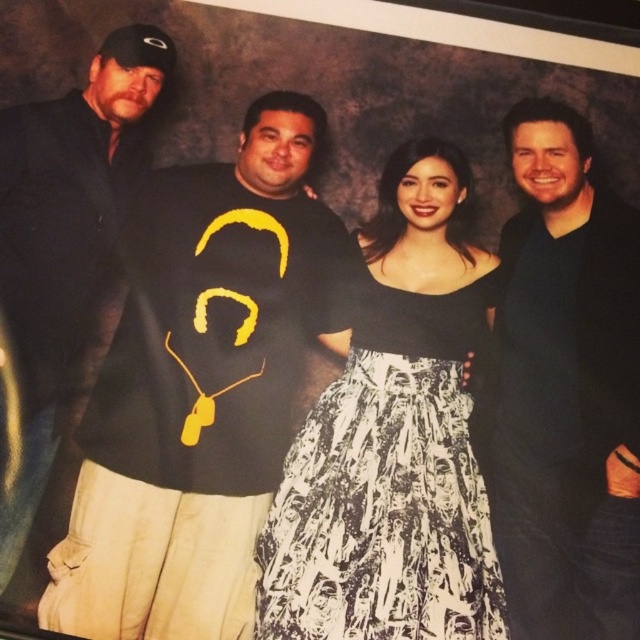
How distant is black satin dress at center from black matte jacket at upper left?

A distance of 24.20 inches exists between black satin dress at center and black matte jacket at upper left.

Does black satin dress at center have a lesser height compared to black matte jacket at upper left?

Yes.

What do you see at coordinates (394, 440) in the screenshot?
I see `black satin dress at center` at bounding box center [394, 440].

The image size is (640, 640). I want to click on black satin dress at center, so click(394, 440).

Does black matte shirt at right have a lesser height compared to black matte jacket at upper left?

Yes, black matte shirt at right is shorter than black matte jacket at upper left.

Can you confirm if black matte shirt at right is positioned below black matte jacket at upper left?

Yes, black matte shirt at right is below black matte jacket at upper left.

Between point (630, 630) and point (1, 387), which one is positioned in front?

Positioned in front is point (630, 630).

Find the location of `black matte shirt at right`. black matte shirt at right is located at coordinates (566, 388).

Does black satin dress at center have a larger size compared to black matte shirt at right?

Yes, black satin dress at center is bigger than black matte shirt at right.

Does black satin dress at center appear under black matte shirt at right?

Correct, black satin dress at center is located below black matte shirt at right.

Between point (461, 200) and point (525, 273), which one is positioned in front?

Point (525, 273)

This screenshot has height=640, width=640. Identify the location of black satin dress at center. (394, 440).